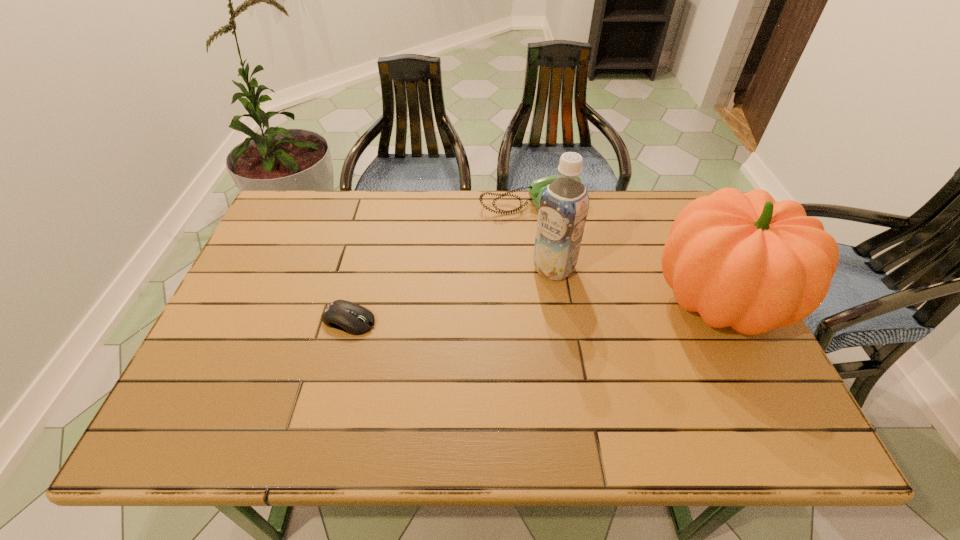
Where is `free space located 0.170m on the dial of the third tallest object`? The image size is (960, 540). free space located 0.170m on the dial of the third tallest object is located at coordinates (566, 255).

You are a GUI agent. You are given a task and a screenshot of the screen. Output one action in this format:
    pyautogui.click(x=<x>, y=<y>)
    Task: Click on the free region located on the label of the soya milk
    The image size is (960, 540).
    Given the screenshot: What is the action you would take?
    pyautogui.click(x=522, y=296)

Locate an element on the screen. The width and height of the screenshot is (960, 540). free location located 0.300m on the label of the soya milk is located at coordinates (463, 348).

Find the location of a particular element. The height and width of the screenshot is (540, 960). vacant space located 0.260m on the label of the soya milk is located at coordinates (474, 338).

Locate an element on the screen. The height and width of the screenshot is (540, 960). object that is at the far edge is located at coordinates (537, 187).

You are a GUI agent. You are given a task and a screenshot of the screen. Output one action in this format:
    pyautogui.click(x=<x>, y=<y>)
    Task: Click on the object at the right edge
    The height and width of the screenshot is (540, 960).
    Given the screenshot: What is the action you would take?
    pyautogui.click(x=747, y=261)

Find the location of a particular element. vacant space at the far edge of the desktop is located at coordinates (354, 209).

Image resolution: width=960 pixels, height=540 pixels. In the image, there is a desktop. What are the coordinates of `vacant space at the near edge` in the screenshot? It's located at (678, 393).

Locate an element on the screen. The height and width of the screenshot is (540, 960). vacant space at the left edge of the desktop is located at coordinates (247, 355).

Locate an element on the screen. Image resolution: width=960 pixels, height=540 pixels. free region at the right edge of the desktop is located at coordinates (757, 363).